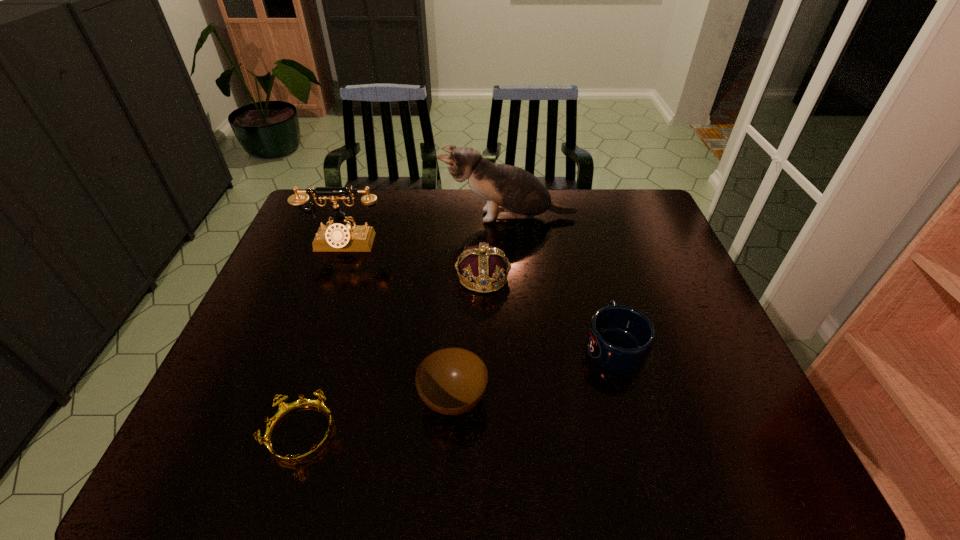
Locate an element on the screen. The image size is (960, 540). object present at the far edge is located at coordinates (511, 192).

Find the location of a particular element. The height and width of the screenshot is (540, 960). object located at the near edge is located at coordinates (285, 409).

Locate an element on the screen. The height and width of the screenshot is (540, 960). telephone present at the left edge is located at coordinates (340, 236).

Find the location of `crown present at the left edge`. crown present at the left edge is located at coordinates (285, 409).

The width and height of the screenshot is (960, 540). I want to click on object that is at the near left corner, so point(285,409).

The width and height of the screenshot is (960, 540). In order to click on vacant space at the far edge of the desktop in this screenshot , I will do `click(356, 223)`.

Find the location of a particular element. This screenshot has height=540, width=960. vacant region at the near edge of the desktop is located at coordinates (675, 447).

I want to click on vacant region at the left edge of the desktop, so click(244, 335).

I want to click on vacant area at the right edge of the desktop, so click(638, 237).

The height and width of the screenshot is (540, 960). I want to click on vacant space at the near left corner of the desktop, so click(249, 436).